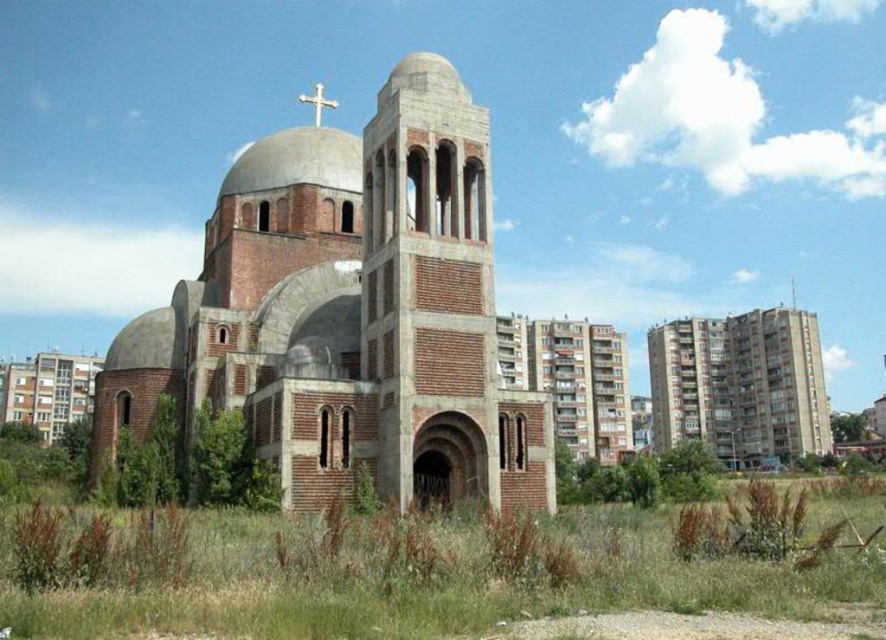
Question: Which object is farther from the camera taking this photo?

Choices:
 (A) white wooden cross at upper center
 (B) red brick chapel at center

Answer: (A)

Question: From the image, what is the correct spatial relationship of concrete building at right in relation to brick church at left?

Choices:
 (A) left
 (B) right

Answer: (B)

Question: Can you confirm if red brick chapel at center is wider than brick church at left?

Choices:
 (A) no
 (B) yes

Answer: (A)

Question: Is concrete building at right to the left of white wooden cross at upper center from the viewer's perspective?

Choices:
 (A) yes
 (B) no

Answer: (B)

Question: Which point is closer to the camera?

Choices:
 (A) concrete building at right
 (B) red brick chapel at center

Answer: (B)

Question: Which point appears closest to the camera in this image?

Choices:
 (A) [706, 356]
 (B) [486, 179]
 (C) [323, 88]

Answer: (B)